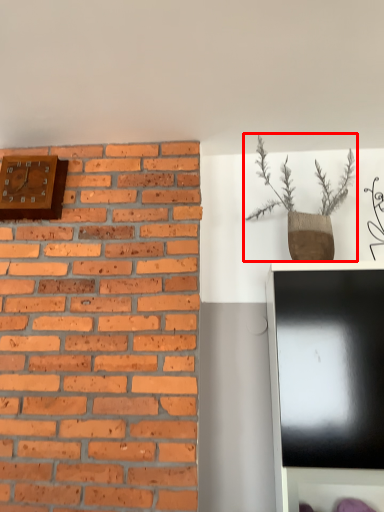
Question: From the image's perspective, where is houseplant (annotated by the red box) located relative to clock?

Choices:
 (A) above
 (B) below

Answer: (B)